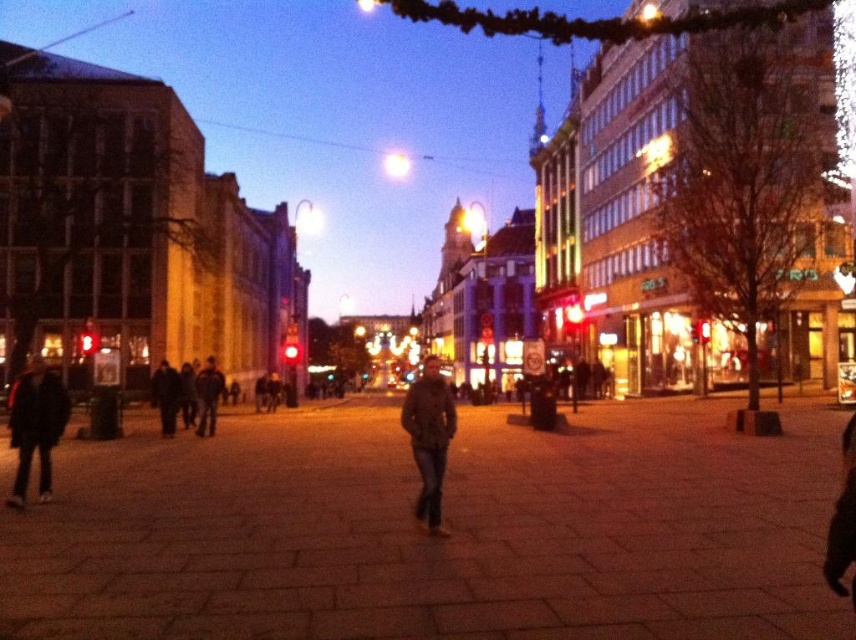
At what (x,y) coordinates should I click in order to perform the action: click on brown leather jacket at center. Please return your answer as a coordinate pair (x, y). The width and height of the screenshot is (856, 640). Looking at the image, I should click on (429, 436).

Find the location of a particular element. brown leather jacket at center is located at coordinates click(429, 436).

The width and height of the screenshot is (856, 640). Find the location of `brown leather jacket at center`. brown leather jacket at center is located at coordinates (429, 436).

What do you see at coordinates (429, 436) in the screenshot? This screenshot has height=640, width=856. I see `brown leather jacket at center` at bounding box center [429, 436].

Is the position of brown leather jacket at center less distant than that of dark brown leather jacket at lower left?

Yes, brown leather jacket at center is in front of dark brown leather jacket at lower left.

The width and height of the screenshot is (856, 640). Identify the location of brown leather jacket at center. (429, 436).

Between brown leather jacket at center and dark blue jeans at center, which one has more height?

brown leather jacket at center

Which is above, brown leather jacket at center or dark blue jeans at center?

brown leather jacket at center

Which is behind, point (428, 520) or point (201, 376)?

The point (201, 376) is behind.

The width and height of the screenshot is (856, 640). In order to click on brown leather jacket at center in this screenshot , I will do `click(429, 436)`.